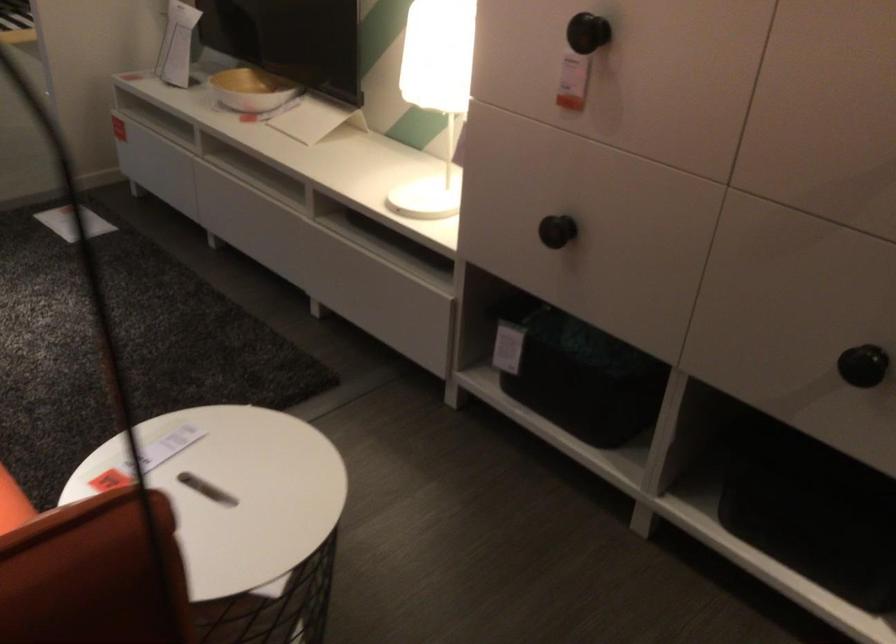
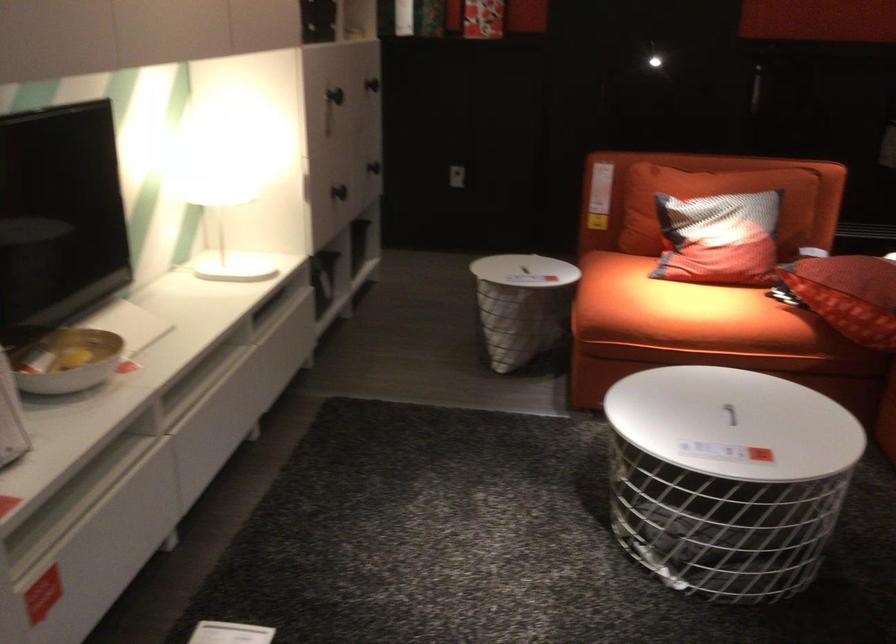
The point at (264, 174) is marked in the first image. Where is the corresponding point in the second image?

(200, 381)